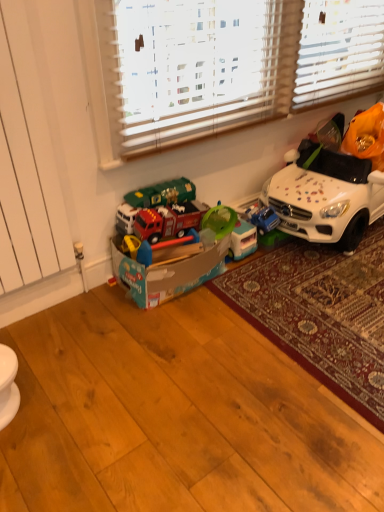
The width and height of the screenshot is (384, 512). Identify the location of free location in front of red plastic toy truck at center, which ranks as the first toy in left-to-right order. 165,337.